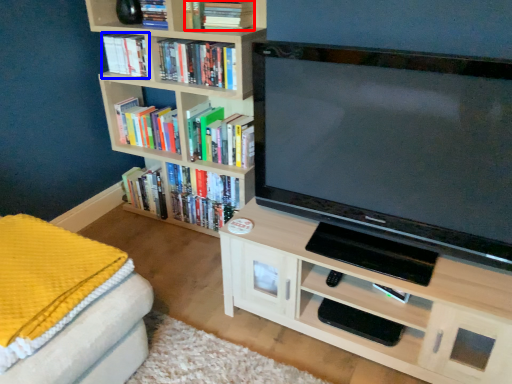
Question: Which of the following is the closest to the observer, book (highlighted by a red box) or book (highlighted by a blue box)?

Choices:
 (A) book
 (B) book

Answer: (A)